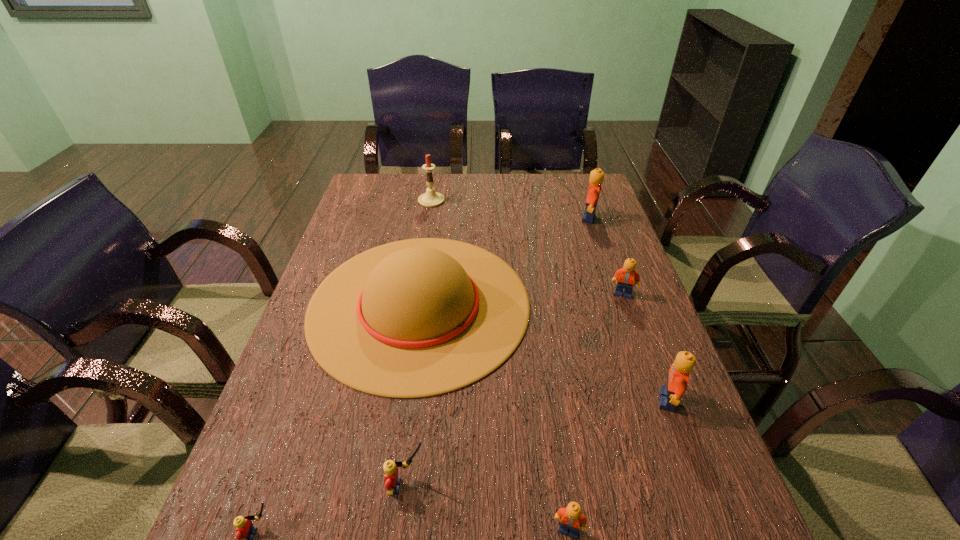
At what (x,y) coordinates should I click in order to perform the action: click on the farther yellow Lego. Please return your answer as a coordinate pair (x, y). Looking at the image, I should click on (392, 484).

Identify the location of the nearest orange Lego. The image size is (960, 540). (572, 518).

The width and height of the screenshot is (960, 540). What are the coordinates of `the smallest orange Lego` in the screenshot? It's located at (572, 518).

Locate an element on the screen. free space located 0.380m on the front-facing side of the farthest orange Lego is located at coordinates pos(468,218).

Image resolution: width=960 pixels, height=540 pixels. I want to click on vacant point located 0.140m on the front-facing side of the farthest orange Lego, so click(539, 218).

At what (x,y) coordinates should I click in order to perform the action: click on vacant space located 0.180m on the front-facing side of the farthest orange Lego. Please return your answer as a coordinate pair (x, y). This screenshot has height=540, width=960. Looking at the image, I should click on (527, 218).

The width and height of the screenshot is (960, 540). What are the coordinates of `free space located 0.250m on the front of the candle` in the screenshot? It's located at (423, 252).

Image resolution: width=960 pixels, height=540 pixels. Find the location of `free space located on the back of the sombrero`. free space located on the back of the sombrero is located at coordinates (437, 187).

The height and width of the screenshot is (540, 960). Find the location of `vacant area situated on the front-facing side of the fifth shortest Lego`. vacant area situated on the front-facing side of the fifth shortest Lego is located at coordinates (624, 400).

Find the location of a particular element. The image size is (960, 540). free spot located on the front-facing side of the fifth shortest Lego is located at coordinates (486, 400).